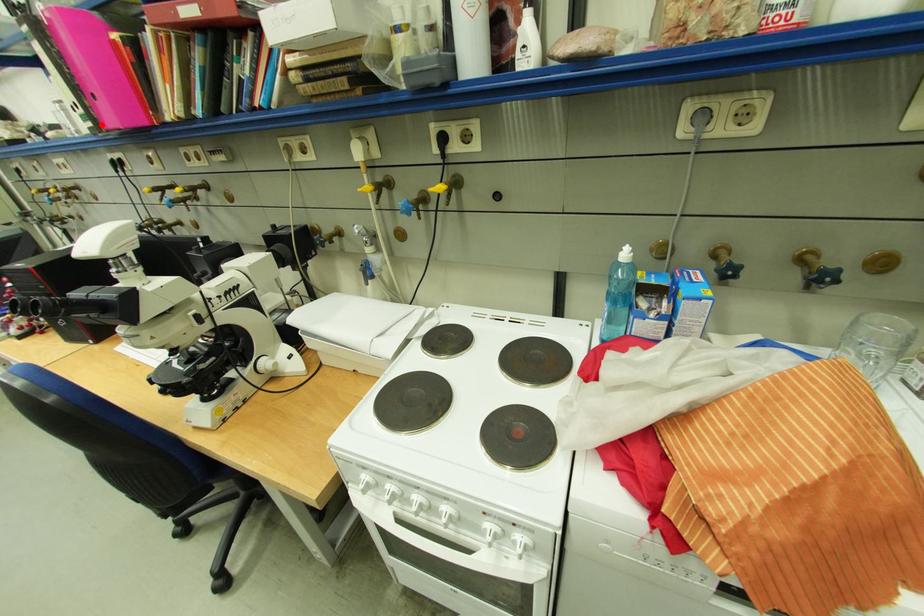
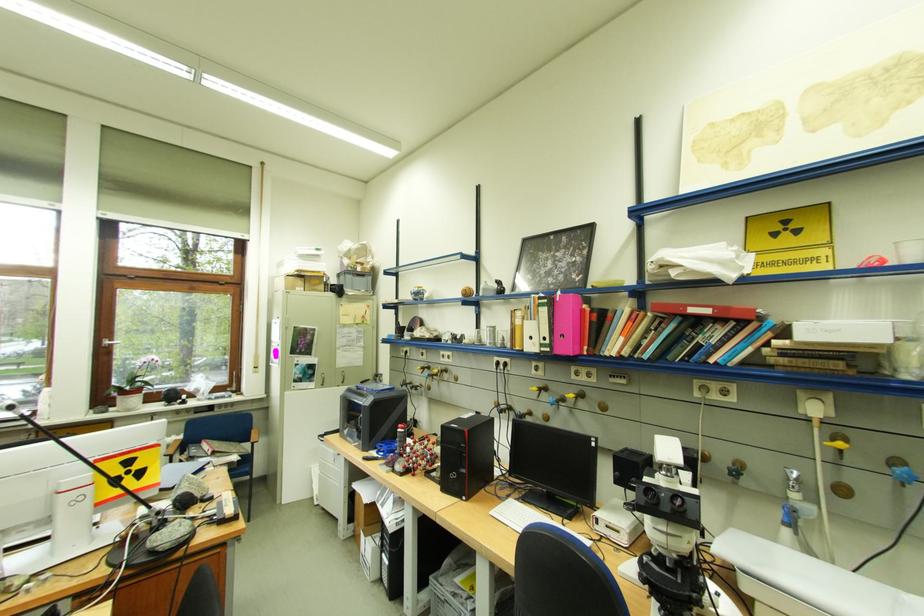
Find the pixel in the second image that matches the highlighted location in the first image.

(558, 351)